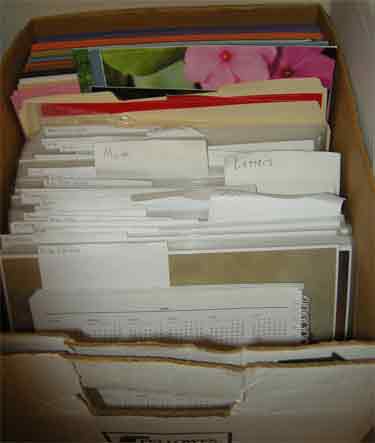
Where is `calendar`? calendar is located at coordinates (169, 321).